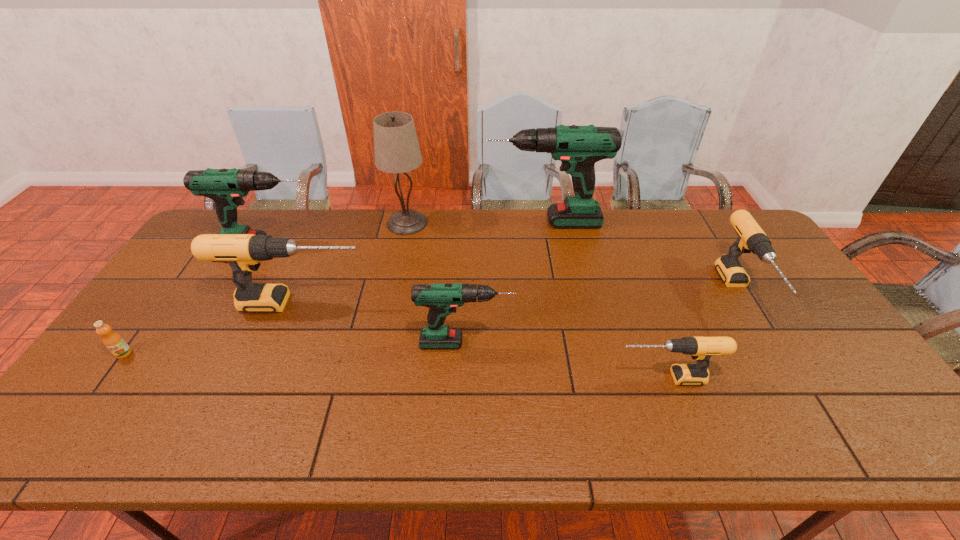
In order to click on black drill that is the nearest to the orange juice in this screenshot , I will do `click(242, 252)`.

The image size is (960, 540). Find the location of `black drill that is the second closest to the nearest object`. black drill that is the second closest to the nearest object is located at coordinates (242, 252).

At what (x,y) coordinates should I click in order to perform the action: click on blank area in the image that satisfies the following two spatial constraints: 1. on the handle side of the nearest green drill; 2. on the front label of the leftmost object. Please return your answer as a coordinate pair (x, y). The height and width of the screenshot is (540, 960). Looking at the image, I should click on (466, 353).

Locate an element on the screen. free location that satisfies the following two spatial constraints: 1. on the front-facing side of the lampshade; 2. on the handle side of the third farthest object is located at coordinates (402, 246).